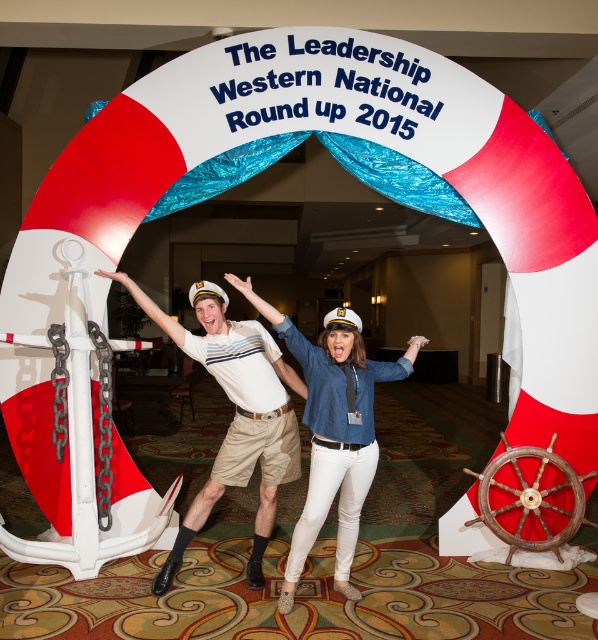
You are attending the Leadership Western National Roundup 2015 event and notice two shirts displayed at the entrance. The white cotton shirt at center and the denim shirt at center. Which shirt is located to the left of the other?

The white cotton shirt at center is positioned on the left side of denim shirt at center.